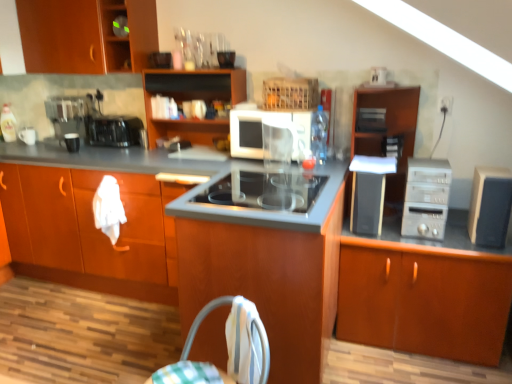
Question: In which direction should I rotate to look at satin silver toaster at upper center, which ranks as the 2th appliance in right-to-left order?

Choices:
 (A) left
 (B) right

Answer: (B)

Question: Considering the relative sizes of wooden cabinet at upper left and black plastic speaker at right, the third appliance when ordered from left to right, in the image provided, is wooden cabinet at upper left bigger than black plastic speaker at right, the third appliance when ordered from left to right,?

Choices:
 (A) yes
 (B) no

Answer: (A)

Question: From the image's perspective, does wooden cabinet at upper left appear lower than black plastic speaker at right, the 4th appliance when ordered from back to front?

Choices:
 (A) yes
 (B) no

Answer: (B)

Question: Is wooden cabinet at upper left behind black plastic speaker at right, the third appliance from the right?

Choices:
 (A) yes
 (B) no

Answer: (A)

Question: Could you tell me if wooden cabinet at upper left is turned towards black plastic speaker at right, the third appliance from the right?

Choices:
 (A) yes
 (B) no

Answer: (B)

Question: Considering the relative sizes of wooden cabinet at upper left and black plastic speaker at right, the third appliance when ordered from left to right, in the image provided, is wooden cabinet at upper left thinner than black plastic speaker at right, the third appliance when ordered from left to right,?

Choices:
 (A) yes
 (B) no

Answer: (B)

Question: Is black plastic speaker at right, the 4th appliance when ordered from back to front, at the back of wooden cabinet at upper left?

Choices:
 (A) no
 (B) yes

Answer: (A)

Question: From the image's perspective, is wooden cabinet at upper left, the seventh cabinetry when ordered from right to left, on top of metallic black coffee machine at left?

Choices:
 (A) no
 (B) yes

Answer: (B)

Question: Can metallic black coffee machine at left be found inside wooden cabinet at upper left, which ranks as the 1th cabinetry in left-to-right order?

Choices:
 (A) no
 (B) yes

Answer: (A)

Question: Could you tell me if wooden cabinet at upper left, which ranks as the 1th cabinetry in left-to-right order, is facing metallic black coffee machine at left?

Choices:
 (A) no
 (B) yes

Answer: (A)

Question: Is the position of wooden cabinet at upper left, the seventh cabinetry when ordered from right to left, more distant than that of metallic black coffee machine at left?

Choices:
 (A) yes
 (B) no

Answer: (B)

Question: Can you confirm if wooden cabinet at upper left, the seventh cabinetry when ordered from right to left, is shorter than metallic black coffee machine at left?

Choices:
 (A) no
 (B) yes

Answer: (A)

Question: From a real-world perspective, does wooden cabinet at upper left, which ranks as the 1th cabinetry in left-to-right order, stand above metallic black coffee machine at left?

Choices:
 (A) yes
 (B) no

Answer: (A)

Question: Would you say wooden cabinet at center, positioned as the 6th cabinetry in right-to-left order, is part of wooden cabinet at center, the fifth cabinetry viewed from the left,'s contents?

Choices:
 (A) no
 (B) yes

Answer: (A)